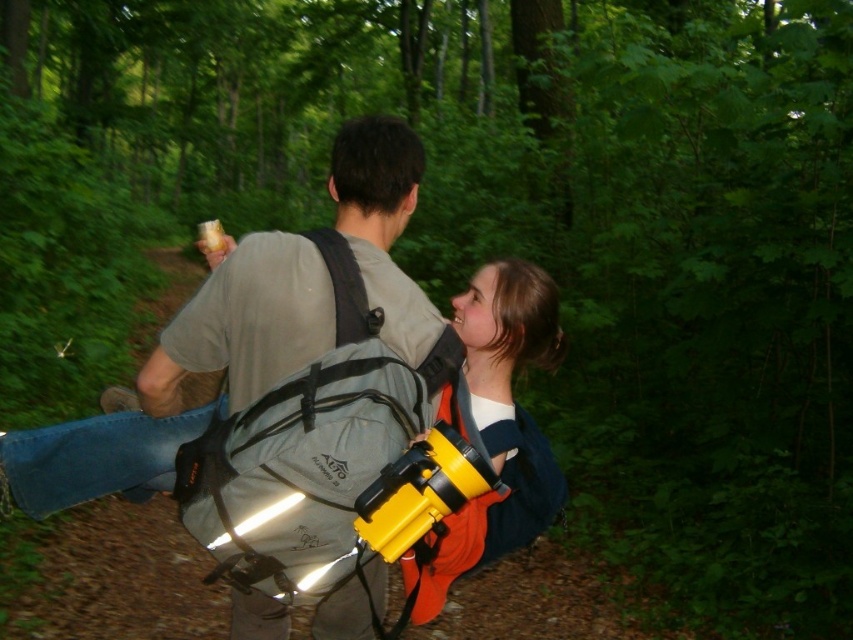
Question: Which object appears farthest from the camera in this image?

Choices:
 (A) gray fabric backpack at center
 (B) black fabric strap at upper center
 (C) yellow matte camera at center

Answer: (B)

Question: Estimate the real-world distances between objects in this image. Which object is closer to the yellow plastic camera at center?

Choices:
 (A) black fabric strap at upper center
 (B) gray fabric backpack at center

Answer: (B)

Question: Does gray fabric backpack at center have a greater width compared to yellow plastic camera at center?

Choices:
 (A) no
 (B) yes

Answer: (B)

Question: Is gray fabric backpack at center wider than black fabric strap at upper center?

Choices:
 (A) no
 (B) yes

Answer: (B)

Question: Considering the relative positions of yellow plastic camera at center and black fabric strap at upper center in the image provided, where is yellow plastic camera at center located with respect to black fabric strap at upper center?

Choices:
 (A) above
 (B) below

Answer: (B)

Question: Which point is farther from the camera taking this photo?

Choices:
 (A) (354, 298)
 (B) (363, 296)

Answer: (B)